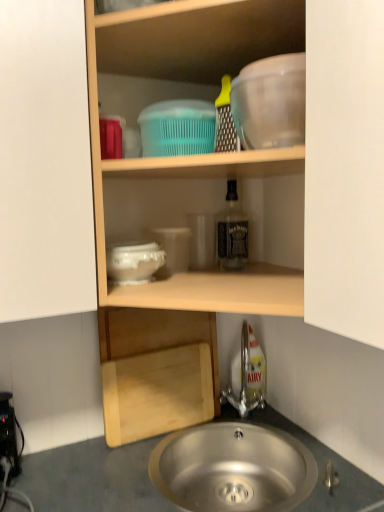
Question: Does white glossy bowl at center, marked as the second basin in a top-to-bottom arrangement, have a lesser width compared to smooth gray countertop at lower center?

Choices:
 (A) yes
 (B) no

Answer: (A)

Question: Is white glossy bowl at center, the 1th basin from the bottom, placed right next to smooth gray countertop at lower center?

Choices:
 (A) yes
 (B) no

Answer: (B)

Question: Does white glossy bowl at center, marked as the second basin in a top-to-bottom arrangement, have a greater width compared to smooth gray countertop at lower center?

Choices:
 (A) no
 (B) yes

Answer: (A)

Question: From the image's perspective, would you say white glossy bowl at center, the 1th basin from the bottom, is shown under smooth gray countertop at lower center?

Choices:
 (A) no
 (B) yes

Answer: (A)

Question: Is the depth of white glossy bowl at center, marked as the second basin in a top-to-bottom arrangement, less than that of smooth gray countertop at lower center?

Choices:
 (A) yes
 (B) no

Answer: (B)

Question: Looking at their shapes, would you say transparent plastic mixing bowl at upper right is wider or thinner than white glossy bowl at center, marked as the second basin in a top-to-bottom arrangement?

Choices:
 (A) wide
 (B) thin

Answer: (B)

Question: Do you think transparent plastic mixing bowl at upper right is within white glossy bowl at center, the 1th basin from the bottom, or outside of it?

Choices:
 (A) outside
 (B) inside

Answer: (A)

Question: From a real-world perspective, is transparent plastic mixing bowl at upper right positioned above or below white glossy bowl at center, marked as the second basin in a top-to-bottom arrangement?

Choices:
 (A) below
 (B) above

Answer: (B)

Question: Is point (276, 106) positioned closer to the camera than point (140, 278)?

Choices:
 (A) closer
 (B) farther

Answer: (A)

Question: From a real-world perspective, is clear glass bottle at center above or below black plastic power strip at lower left?

Choices:
 (A) below
 (B) above

Answer: (B)

Question: Considering their positions, is clear glass bottle at center located in front of or behind black plastic power strip at lower left?

Choices:
 (A) behind
 (B) front

Answer: (A)

Question: Visually, is clear glass bottle at center positioned to the left or to the right of black plastic power strip at lower left?

Choices:
 (A) right
 (B) left

Answer: (A)

Question: Is clear glass bottle at center wider or thinner than black plastic power strip at lower left?

Choices:
 (A) wide
 (B) thin

Answer: (B)

Question: Based on their sizes in the image, would you say transparent plastic mixing bowl at upper right is bigger or smaller than black plastic power strip at lower left?

Choices:
 (A) small
 (B) big

Answer: (B)

Question: Is transparent plastic mixing bowl at upper right to the left or to the right of black plastic power strip at lower left in the image?

Choices:
 (A) left
 (B) right

Answer: (B)